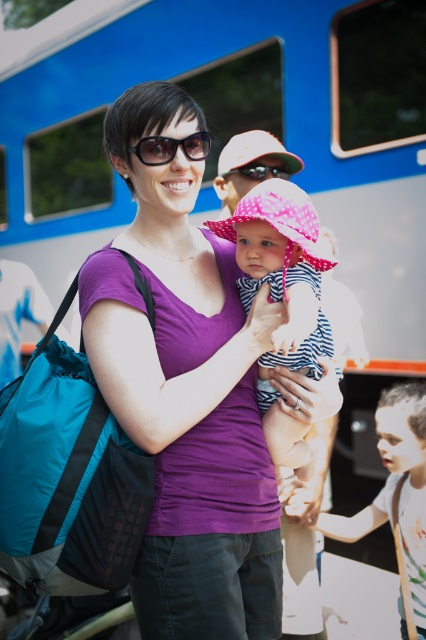
Is striped fabric baby at center above matte black goggles at center?

No, striped fabric baby at center is not above matte black goggles at center.

Is striped fabric baby at center behind matte black goggles at center?

No, it is in front of matte black goggles at center.

Where is `striped fabric baby at center`? striped fabric baby at center is located at coordinates (282, 298).

Does striped fabric baby at center appear over light brown hair at lower right?

Indeed, striped fabric baby at center is positioned over light brown hair at lower right.

Can you confirm if striped fabric baby at center is positioned below light brown hair at lower right?

No, striped fabric baby at center is not below light brown hair at lower right.

Describe the element at coordinates (282, 298) in the screenshot. The image size is (426, 640). I see `striped fabric baby at center` at that location.

I want to click on striped fabric baby at center, so click(282, 298).

Based on the photo, can you confirm if light brown hair at lower right is thinner than matte black goggles at center?

No.

Between light brown hair at lower right and matte black goggles at center, which one has less height?

Standing shorter between the two is matte black goggles at center.

Where is `light brown hair at lower right`? This screenshot has width=426, height=640. light brown hair at lower right is located at coordinates (397, 486).